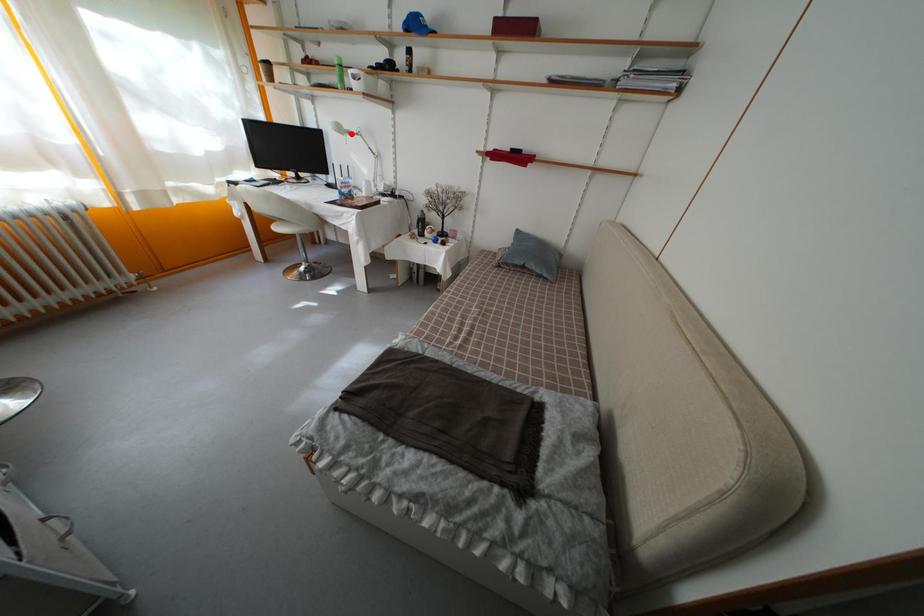
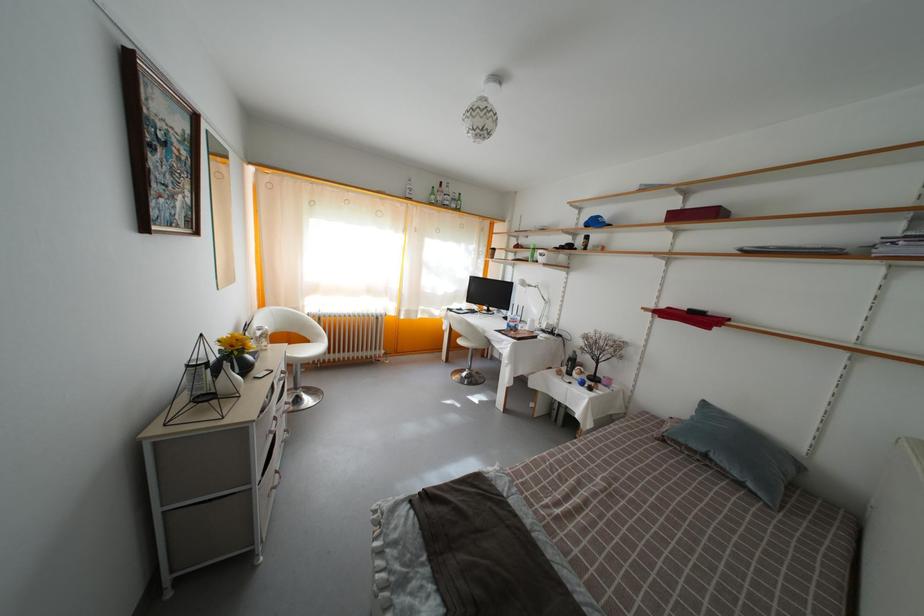
In the second image, find the point that corresponds to the highlighted location in the first image.

(533, 289)